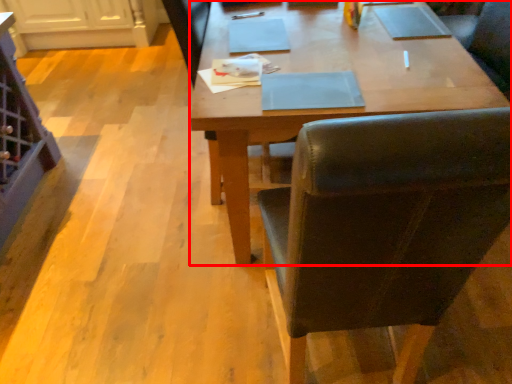
Question: From the image's perspective, considering the relative positions of desk (annotated by the red box) and chair in the image provided, where is desk (annotated by the red box) located with respect to the staircase?

Choices:
 (A) below
 (B) above

Answer: (B)